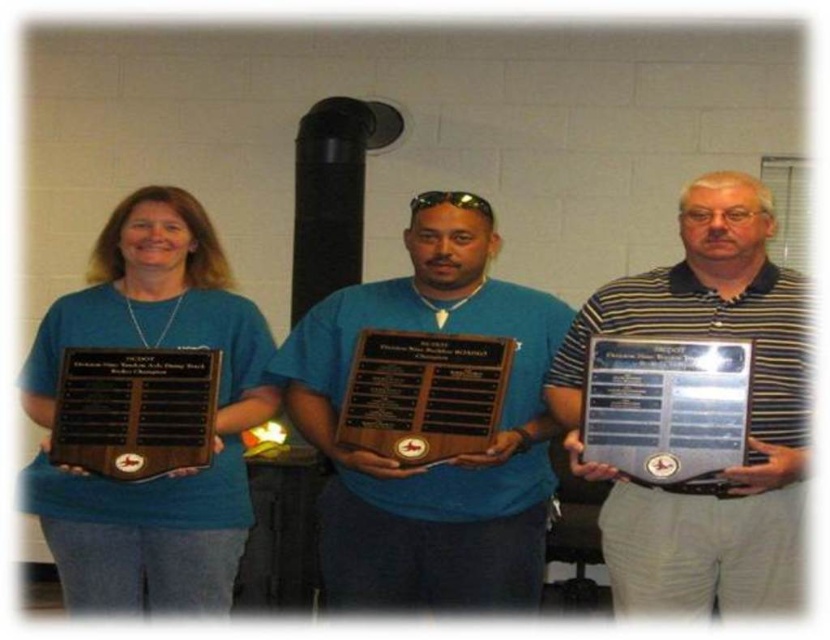
Is matte wood plaque at center taller than matte black plaque at left?

No.

Is point (403, 509) farther from viewer compared to point (201, 314)?

No, it is in front of (201, 314).

Is point (487, 232) positioned after point (220, 408)?

Yes, point (487, 232) is behind point (220, 408).

You are a GUI agent. You are given a task and a screenshot of the screen. Output one action in this format:
    pyautogui.click(x=<x>, y=<y>)
    Task: Click on the matte wood plaque at center
    The image size is (830, 640).
    Given the screenshot: What is the action you would take?
    pyautogui.click(x=440, y=464)

Who is more forward, (427, 531) or (105, 440)?

Point (105, 440) is more forward.

Can you confirm if matte wood plaque at center is positioned below black polished wood plaque at left?

Yes, matte wood plaque at center is below black polished wood plaque at left.

Does point (486, 568) come farther from viewer compared to point (173, 461)?

Yes, it is behind point (173, 461).

The height and width of the screenshot is (640, 830). What are the coordinates of `matte wood plaque at center` in the screenshot? It's located at (440, 464).

In the scene shown: Does silver metallic plaque at center appear under metallic silver plaque at center?

No, silver metallic plaque at center is not below metallic silver plaque at center.

Between point (665, 289) and point (723, 464), which one is positioned behind?

The point (665, 289) is behind.

Find the location of a particular element. silver metallic plaque at center is located at coordinates (748, 424).